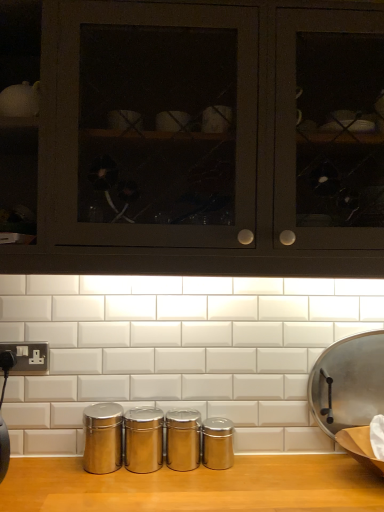
You are a GUI agent. You are given a task and a screenshot of the screen. Output one action in this format:
    pyautogui.click(x=<x>, y=<y>)
    Task: Click on the metallic silver frying pan at right
    
    Given the screenshot: What is the action you would take?
    pyautogui.click(x=348, y=383)

I want to click on matte black cabinets at upper center, so click(207, 138).

Is silver metallic plug socket at lower left facing towards metallic silver frying pan at right?

No, silver metallic plug socket at lower left is not oriented towards metallic silver frying pan at right.

There is a metallic silver frying pan at right. Identify the location of electric outlet above it (from a real-world perspective). (28, 357).

Does silver metallic plug socket at lower left have a greater width compared to metallic silver frying pan at right?

Incorrect, the width of silver metallic plug socket at lower left does not surpass that of metallic silver frying pan at right.

Measure the distance from silver metallic plug socket at lower left to metallic silver frying pan at right.

silver metallic plug socket at lower left is 34.54 inches away from metallic silver frying pan at right.

Who is smaller, matte black cabinets at upper center or silver metallic plug socket at lower left?

silver metallic plug socket at lower left is smaller.

Is matte black cabinets at upper center further to the viewer compared to silver metallic plug socket at lower left?

No, matte black cabinets at upper center is in front of silver metallic plug socket at lower left.

From the picture: Is matte black cabinets at upper center positioned far away from silver metallic plug socket at lower left?

matte black cabinets at upper center is near silver metallic plug socket at lower left, not far away.

Is matte black cabinets at upper center at the left side of silver metallic plug socket at lower left?

Incorrect, matte black cabinets at upper center is not on the left side of silver metallic plug socket at lower left.

Which of these two, matte black cabinets at upper center or metallic silver frying pan at right, is smaller?

metallic silver frying pan at right.

How much distance is there between matte black cabinets at upper center and metallic silver frying pan at right?

matte black cabinets at upper center is 26.06 inches away from metallic silver frying pan at right.

Does point (98, 259) appear closer or farther from the camera than point (323, 362)?

Point (98, 259) is closer to the camera than point (323, 362).

Can you confirm if matte black cabinets at upper center is thinner than metallic silver frying pan at right?

No, matte black cabinets at upper center is not thinner than metallic silver frying pan at right.

Looking at this image, which of these two, silver metallic plug socket at lower left or matte black cabinets at upper center, is thinner?

Thinner between the two is silver metallic plug socket at lower left.

Which of these two, silver metallic plug socket at lower left or matte black cabinets at upper center, stands shorter?

silver metallic plug socket at lower left.

Are silver metallic plug socket at lower left and matte black cabinets at upper center far apart?

They are positioned close to each other.

From a real-world perspective, is metallic silver frying pan at right under silver metallic plug socket at lower left?

Indeed, from a real-world perspective, metallic silver frying pan at right is positioned beneath silver metallic plug socket at lower left.

Measure the distance between metallic silver frying pan at right and silver metallic plug socket at lower left.

The distance of metallic silver frying pan at right from silver metallic plug socket at lower left is 34.54 inches.

Which is in front, metallic silver frying pan at right or silver metallic plug socket at lower left?

Positioned in front is metallic silver frying pan at right.

Is silver metallic plug socket at lower left at the back of metallic silver frying pan at right?

No, silver metallic plug socket at lower left is not at the back of metallic silver frying pan at right.

How different are the orientations of metallic silver frying pan at right and matte black cabinets at upper center in degrees?

The angle between the facing direction of metallic silver frying pan at right and the facing direction of matte black cabinets at upper center is 3.27 degrees.

Between metallic silver frying pan at right and matte black cabinets at upper center, which one is positioned behind?

metallic silver frying pan at right is behind.

Can we say metallic silver frying pan at right lies outside matte black cabinets at upper center?

metallic silver frying pan at right is positioned outside matte black cabinets at upper center.

The image size is (384, 512). Identify the location of electric outlet that is behind the metallic silver frying pan at right. (28, 357).

Identify the location of cabinetry above the silver metallic plug socket at lower left (from the image's perspective). Image resolution: width=384 pixels, height=512 pixels. (207, 138).

Estimate the real-world distances between objects in this image. Which object is closer to silver metallic plug socket at lower left, metallic silver frying pan at right or matte black cabinets at upper center?

matte black cabinets at upper center lies closer to silver metallic plug socket at lower left than the other object.

Estimate the real-world distances between objects in this image. Which object is further from matte black cabinets at upper center, metallic silver frying pan at right or silver metallic plug socket at lower left?

silver metallic plug socket at lower left.

From the image, which object appears to be nearer to metallic silver frying pan at right, silver metallic plug socket at lower left or matte black cabinets at upper center?

matte black cabinets at upper center lies closer to metallic silver frying pan at right than the other object.

Based on their spatial positions, is silver metallic plug socket at lower left or metallic silver frying pan at right further from matte black cabinets at upper center?

silver metallic plug socket at lower left is further to matte black cabinets at upper center.

Estimate the real-world distances between objects in this image. Which object is closer to silver metallic plug socket at lower left, matte black cabinets at upper center or metallic silver frying pan at right?

The object closer to silver metallic plug socket at lower left is matte black cabinets at upper center.

From the image, which object appears to be nearer to metallic silver frying pan at right, matte black cabinets at upper center or silver metallic plug socket at lower left?

Based on the image, matte black cabinets at upper center appears to be nearer to metallic silver frying pan at right.

At what (x,y) coordinates should I click in order to perform the action: click on cabinetry between silver metallic plug socket at lower left and metallic silver frying pan at right. Please return your answer as a coordinate pair (x, y). This screenshot has width=384, height=512. Looking at the image, I should click on (207, 138).